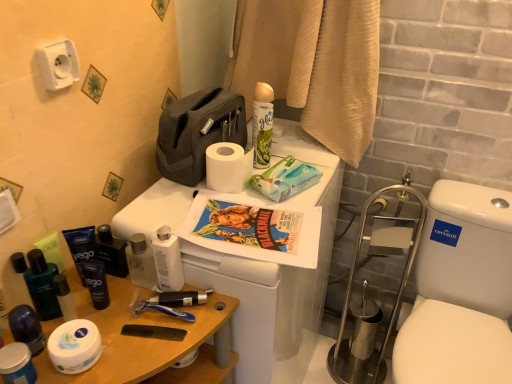
Question: Considering the relative sizes of dark blue matte tube at left, marked as the 2th toiletry in a right-to-left arrangement, and blue matte tube at left, which is the 4th toiletry from right to left, in the image provided, is dark blue matte tube at left, marked as the 2th toiletry in a right-to-left arrangement, wider than blue matte tube at left, which is the 4th toiletry from right to left,?

Choices:
 (A) yes
 (B) no

Answer: (A)

Question: Does dark blue matte tube at left, which ranks as the sixth toiletry in left-to-right order, appear on the right side of blue matte tube at left, positioned as the 4th toiletry in left-to-right order?

Choices:
 (A) yes
 (B) no

Answer: (A)

Question: Can you see dark blue matte tube at left, which ranks as the sixth toiletry in left-to-right order, touching blue matte tube at left, which is the 4th toiletry from right to left?

Choices:
 (A) yes
 (B) no

Answer: (A)

Question: Can you confirm if dark blue matte tube at left, marked as the 2th toiletry in a right-to-left arrangement, is shorter than blue matte tube at left, which is the 4th toiletry from right to left?

Choices:
 (A) no
 (B) yes

Answer: (B)

Question: Is dark blue matte tube at left, which ranks as the sixth toiletry in left-to-right order, at the left side of blue matte tube at left, which is the 4th toiletry from right to left?

Choices:
 (A) no
 (B) yes

Answer: (A)

Question: From the image's perspective, is dark blue matte tube at left, which ranks as the sixth toiletry in left-to-right order, under blue matte tube at left, positioned as the 4th toiletry in left-to-right order?

Choices:
 (A) yes
 (B) no

Answer: (A)

Question: From a real-world perspective, is white matte lotion at center, the 1th toiletry when ordered from right to left, on top of green matte spray can at upper center?

Choices:
 (A) yes
 (B) no

Answer: (B)

Question: Considering the relative sizes of white matte lotion at center, which appears as the seventh toiletry when viewed from the left, and green matte spray can at upper center in the image provided, is white matte lotion at center, which appears as the seventh toiletry when viewed from the left, bigger than green matte spray can at upper center?

Choices:
 (A) no
 (B) yes

Answer: (A)

Question: Is white matte lotion at center, the 1th toiletry when ordered from right to left, facing away from green matte spray can at upper center?

Choices:
 (A) yes
 (B) no

Answer: (A)

Question: Can you see white matte lotion at center, which appears as the seventh toiletry when viewed from the left, touching green matte spray can at upper center?

Choices:
 (A) yes
 (B) no

Answer: (B)

Question: Is white matte lotion at center, which appears as the seventh toiletry when viewed from the left, shorter than green matte spray can at upper center?

Choices:
 (A) yes
 (B) no

Answer: (A)

Question: Could you tell me if white matte lotion at center, the 1th toiletry when ordered from right to left, is turned towards green matte spray can at upper center?

Choices:
 (A) yes
 (B) no

Answer: (B)

Question: Considering the relative positions of white glossy toilet seat at right and dark blue matte tube at left, which ranks as the sixth toiletry in left-to-right order, in the image provided, is white glossy toilet seat at right to the left of dark blue matte tube at left, which ranks as the sixth toiletry in left-to-right order, from the viewer's perspective?

Choices:
 (A) yes
 (B) no

Answer: (B)